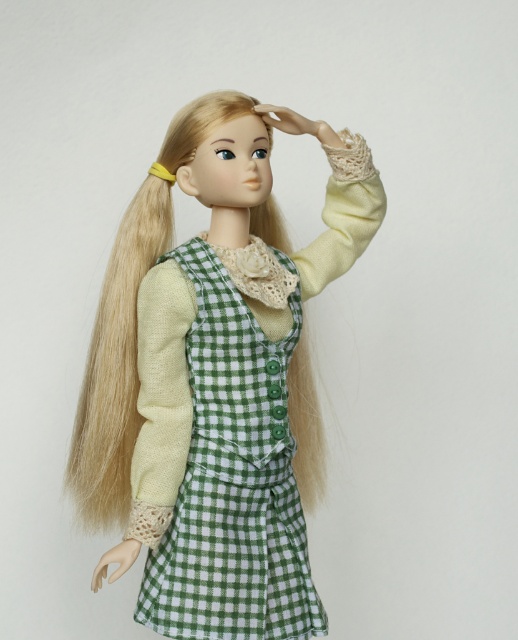
Question: Can you confirm if green checkered dress at center is positioned to the right of green checkered apron at center?

Choices:
 (A) no
 (B) yes

Answer: (A)

Question: Among these points, which one is farthest from the camera?

Choices:
 (A) (227, 429)
 (B) (293, 566)

Answer: (B)

Question: Where is green checkered dress at center located in relation to green checkered apron at center in the image?

Choices:
 (A) below
 (B) above

Answer: (B)

Question: Which point is farther to the camera?

Choices:
 (A) (231, 328)
 (B) (227, 388)

Answer: (B)

Question: Is green checkered dress at center further to camera compared to green checkered apron at center?

Choices:
 (A) no
 (B) yes

Answer: (A)

Question: Which point is farther to the camera?

Choices:
 (A) (249, 387)
 (B) (121, 483)

Answer: (B)